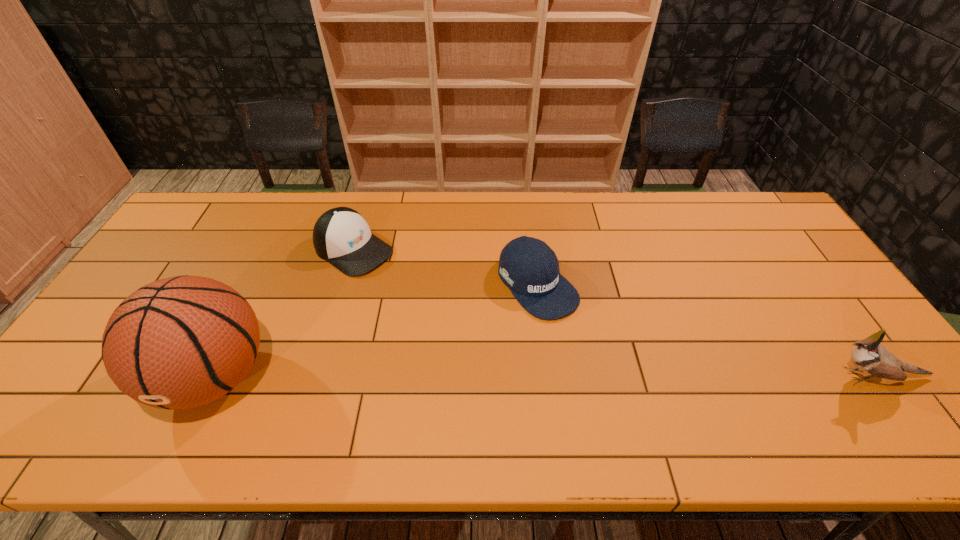
The image size is (960, 540). Identify the location of basketball. (181, 342).

At what (x,y) coordinates should I click in order to perform the action: click on the third shortest object. Please return your answer as a coordinate pair (x, y). Looking at the image, I should click on (869, 356).

Where is `the rightmost object`? This screenshot has width=960, height=540. the rightmost object is located at coordinates (869, 356).

In order to click on cap in this screenshot , I will do `click(341, 236)`.

Locate an element on the screen. This screenshot has width=960, height=540. baseball cap is located at coordinates (527, 266).

Where is `vacant area situated 0.110m at the face of the third shortest object`? This screenshot has width=960, height=540. vacant area situated 0.110m at the face of the third shortest object is located at coordinates (776, 376).

Locate an element on the screen. Image resolution: width=960 pixels, height=540 pixels. vacant space located 0.150m at the face of the third shortest object is located at coordinates (758, 376).

Locate an element on the screen. free region located at the face of the third shortest object is located at coordinates (673, 376).

At what (x,y) coordinates should I click in order to perform the action: click on vacant space located 0.190m on the front panel of the cap. Please return your answer as a coordinate pair (x, y). Looking at the image, I should click on 426,297.

Locate an element on the screen. This screenshot has height=540, width=960. vacant position located 0.190m on the front panel of the cap is located at coordinates (426, 297).